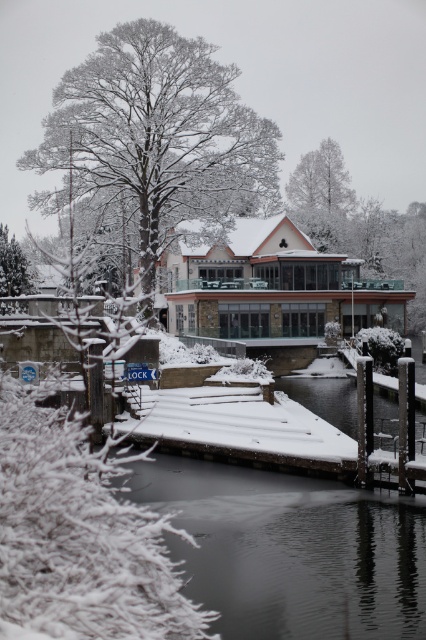
From the picture: You are standing at point A located at coordinates (109,60). You need to walk to point B, which is 47.19 meters away from you. Considering the snow and the wooden dock extending into the water, which direction should you head to reach point B?

Since the points are 47.19 meters apart, you should head towards the wooden dock extending into the water as it provides a clear path over the snow and ice towards point B.